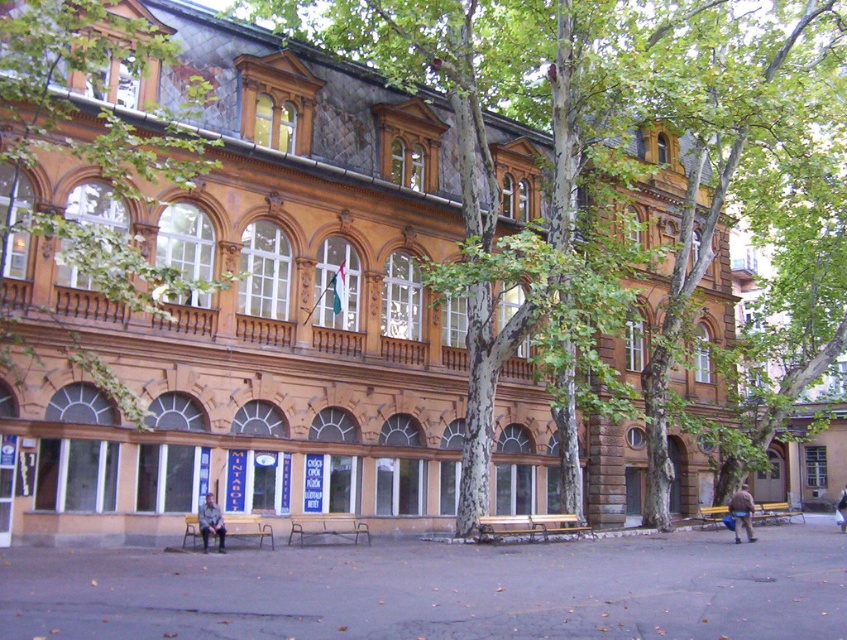
You are standing in front of the building and want to take a photo. You notice two points marked on the building facade. The first point is at coordinates point (x=208, y=540) and the second is at point (x=734, y=508). Which point will appear larger in your camera view?

Point (x=208, y=540) is closer to the camera than point (x=734, y=508), so it will appear larger in the camera view.

You are planning to place a new bench in the garden near the green textured tree at center. The wooden bench at lower right is already there. Considering their sizes, which object would require more space to accommodate?

The green textured tree at center requires more space because it has a larger size compared to the wooden bench at lower right.

You are standing in front of the building and notice two points marked on the facade. The first point is at coordinates point [512,525] and the second is at point [187,513]. Which point is closer to the balcony on the upper level?

Point [512,525] is behind point [187,513], so the point closer to the balcony on the upper level would be point [512,525] since it is positioned further back towards the upper part of the building.